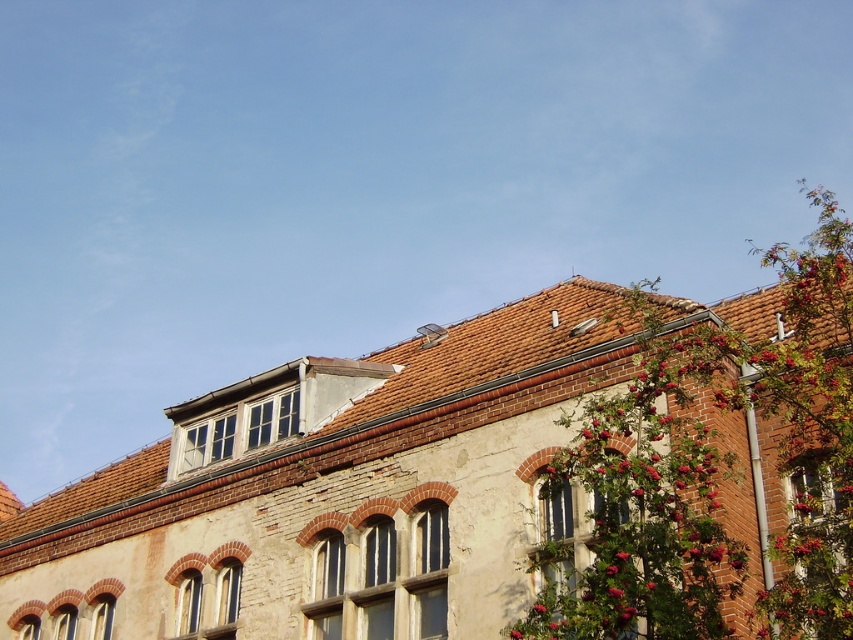
Can you confirm if matte glass window at center is positioned below white stone window at center?

Incorrect, matte glass window at center is not positioned below white stone window at center.

Does matte glass window at center appear on the right side of white stone window at center?

Yes, matte glass window at center is to the right of white stone window at center.

You are a GUI agent. You are given a task and a screenshot of the screen. Output one action in this format:
    pyautogui.click(x=<x>, y=<y>)
    Task: Click on the matte glass window at center
    
    Given the screenshot: What is the action you would take?
    pyautogui.click(x=593, y=548)

Between clear glass window at upper center and white stone window at center, which one has less height?

clear glass window at upper center

Locate an element on the screen. clear glass window at upper center is located at coordinates [x=238, y=429].

At what (x,y) coordinates should I click in order to perform the action: click on clear glass window at upper center. Please return your answer as a coordinate pair (x, y). Image resolution: width=853 pixels, height=640 pixels. Looking at the image, I should click on (238, 429).

Can you confirm if brown stone window at center is bigger than clear glass window at upper center?

Yes, brown stone window at center is bigger than clear glass window at upper center.

Can you confirm if brown stone window at center is positioned to the right of clear glass window at upper center?

Yes, brown stone window at center is to the right of clear glass window at upper center.

What do you see at coordinates (386, 570) in the screenshot? Image resolution: width=853 pixels, height=640 pixels. I see `brown stone window at center` at bounding box center [386, 570].

I want to click on brown stone window at center, so click(386, 570).